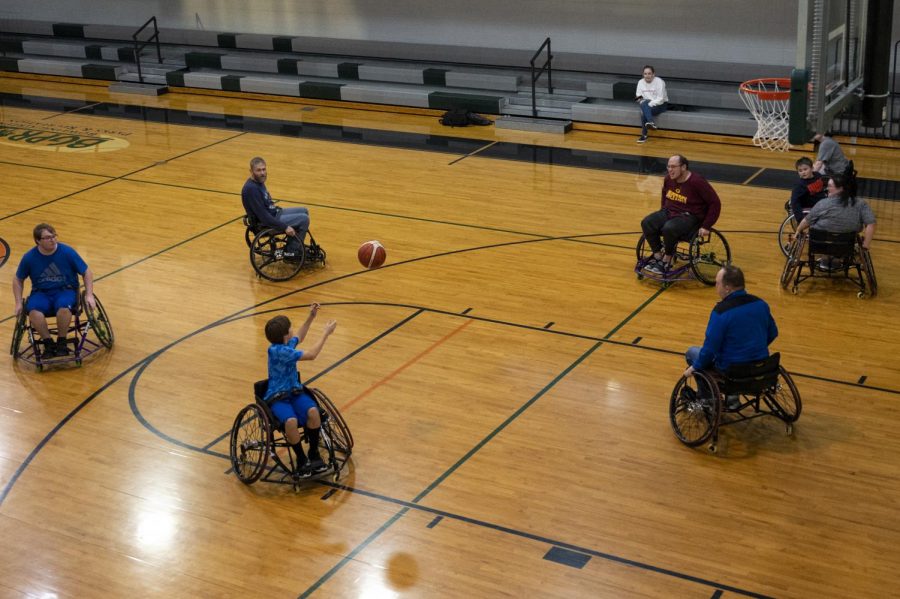
Identify the location of light reflection on wall. (273, 25).